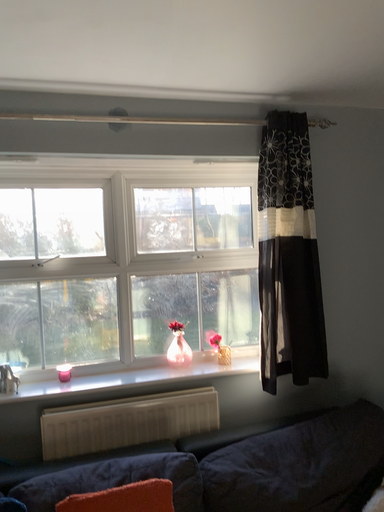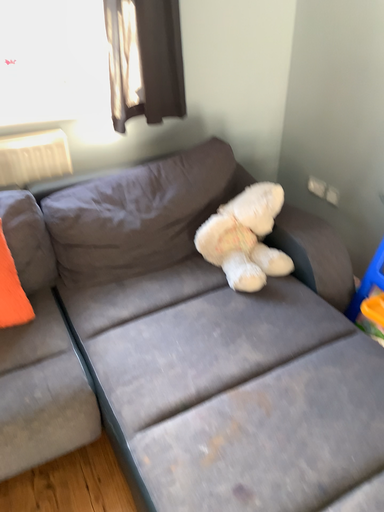
Question: How did the camera likely rotate when shooting the video?

Choices:
 (A) rotated left
 (B) rotated right

Answer: (B)